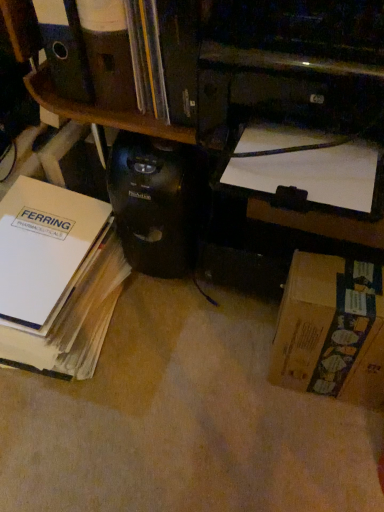
Question: From a real-world perspective, is black plastic printer at upper center above or below black plastic computer tower at center?

Choices:
 (A) below
 (B) above

Answer: (B)

Question: Based on their sizes in the image, would you say black plastic printer at upper center is bigger or smaller than black plastic computer tower at center?

Choices:
 (A) small
 (B) big

Answer: (B)

Question: Which is nearer to the black plastic printer at upper center?

Choices:
 (A) black plastic computer tower at center
 (B) white paper at left, which ranks as the second book in right-to-left order
 (C) brown cardboard box at lower right
 (D) white paper at upper right, which ranks as the 2th book in left-to-right order

Answer: (D)

Question: Estimate the real-world distances between objects in this image. Which object is closer to the white paper at upper right, which is the first book in right-to-left order?

Choices:
 (A) black plastic printer at upper center
 (B) black plastic computer tower at center
 (C) white paper at left, the 1th book positioned from the left
 (D) brown cardboard box at lower right

Answer: (A)